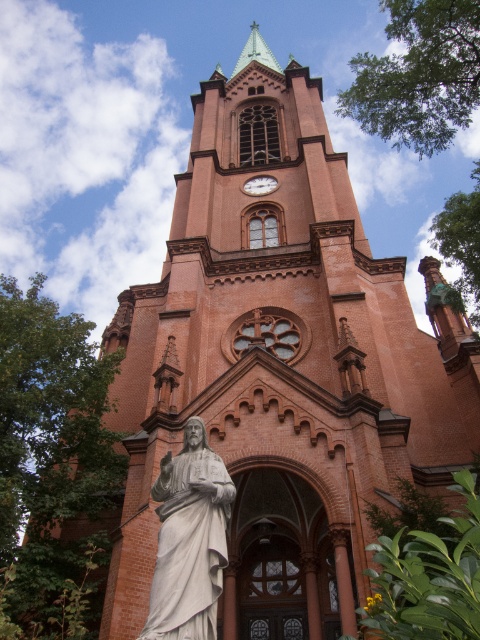
Who is higher up, white marble statue at center or matte brown clock at center?

Positioned higher is matte brown clock at center.

Does white marble statue at center come in front of matte brown clock at center?

Yes, white marble statue at center is in front of matte brown clock at center.

Is point (162, 566) more distant than point (252, 193)?

No, it is not.

The height and width of the screenshot is (640, 480). In order to click on white marble statue at center in this screenshot , I will do `click(189, 540)`.